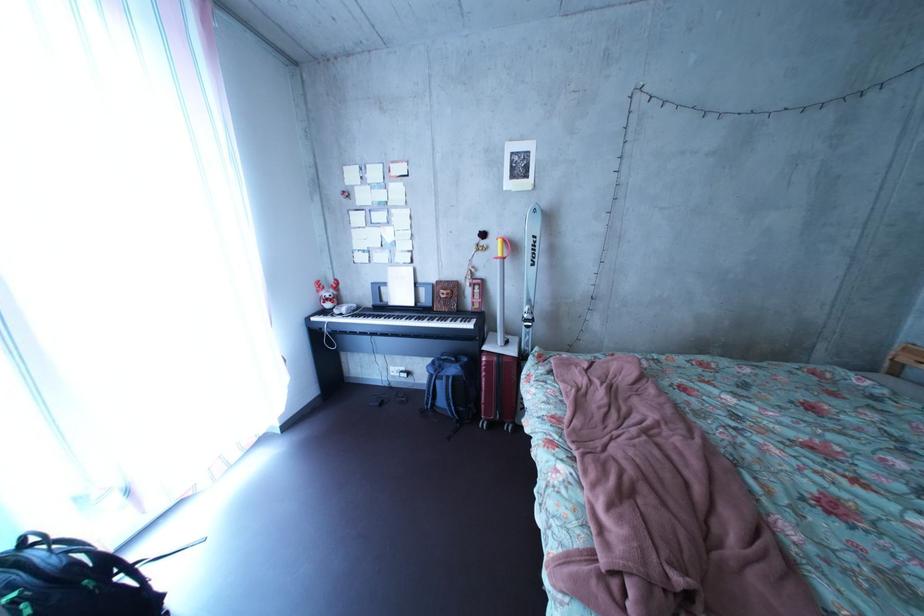
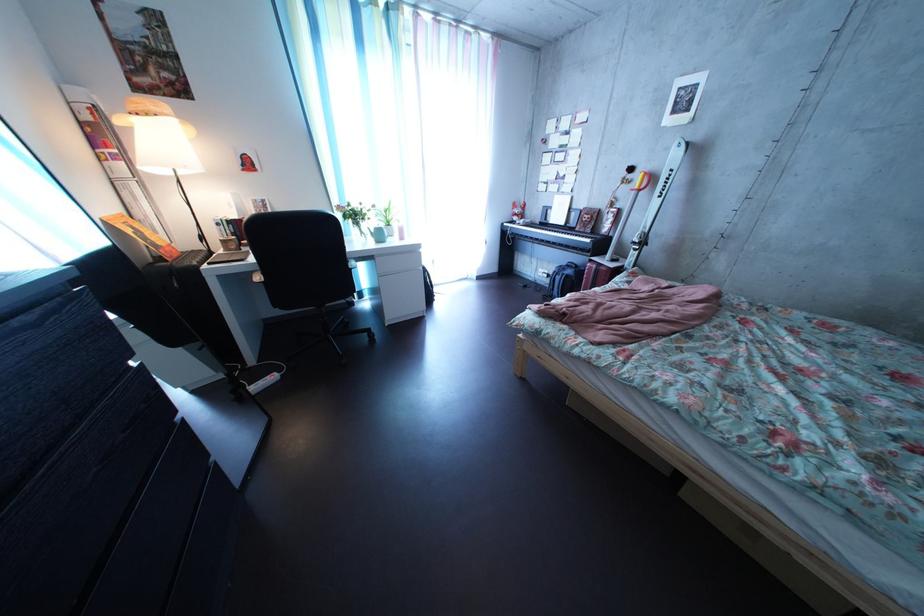
In the second image, find the point that corresponds to point 541,329 in the first image.

(648, 252)